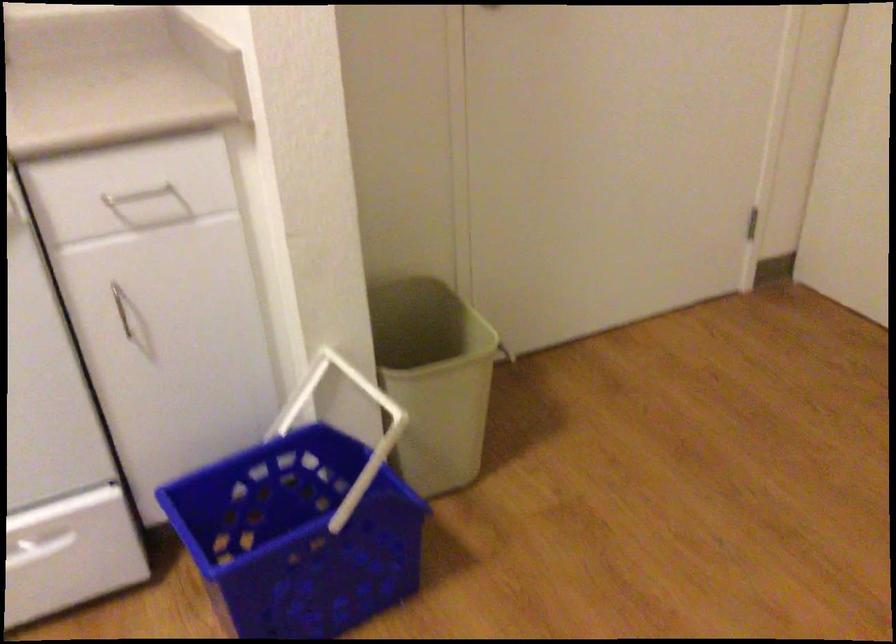
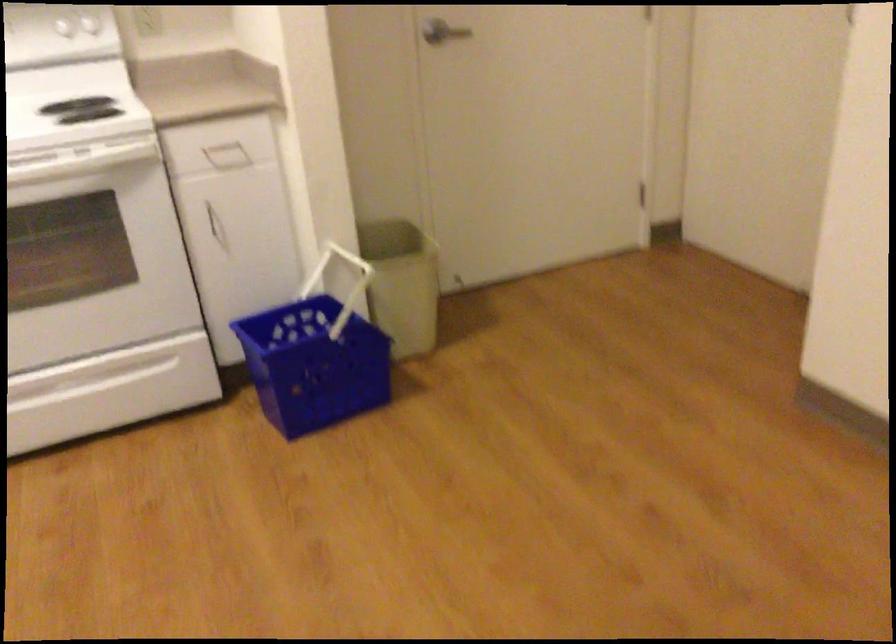
In the second image, find the point that corresponds to the point at 152,214 in the first image.

(227, 156)